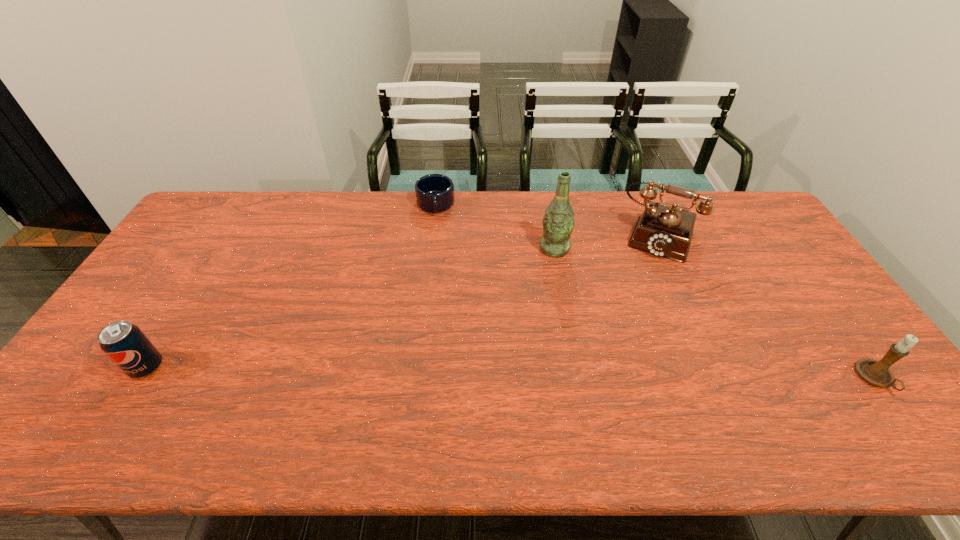
The width and height of the screenshot is (960, 540). What are the coordinates of `the second closest object relative to the telephone` in the screenshot? It's located at (878, 373).

This screenshot has height=540, width=960. I want to click on object that can be found as the third closest to the soda can, so click(x=664, y=231).

I want to click on free space that satisfies the following two spatial constraints: 1. on the back side of the leftmost object; 2. on the right side of the shortest object, so click(249, 205).

Find the location of a particular element. The width and height of the screenshot is (960, 540). vacant position in the image that satisfies the following two spatial constraints: 1. on the back side of the soda can; 2. on the left side of the mug is located at coordinates (249, 205).